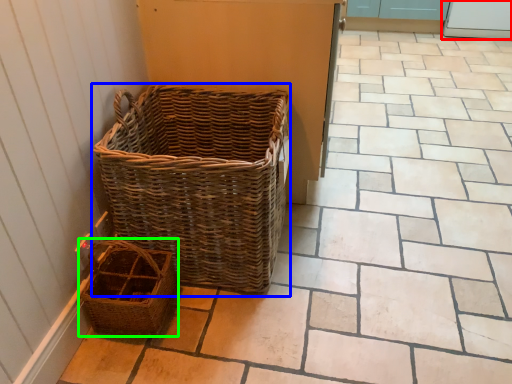
Question: Estimate the real-world distances between objects in this image. Which object is farther from screen door (highlighted by a red box), picnic basket (highlighted by a blue box) or picnic basket (highlighted by a green box)?

Choices:
 (A) picnic basket
 (B) picnic basket

Answer: (B)